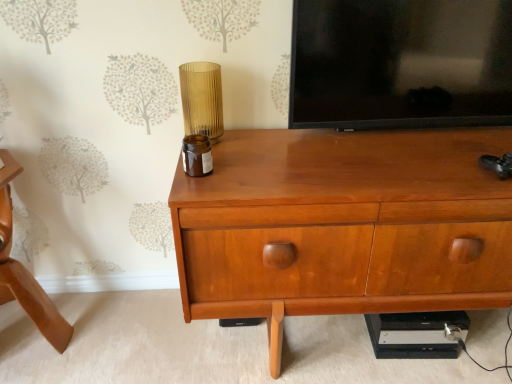
Locate an element on the screen. Image resolution: width=512 pixels, height=384 pixels. vacant space in front of black glossy tv at upper center is located at coordinates (398, 148).